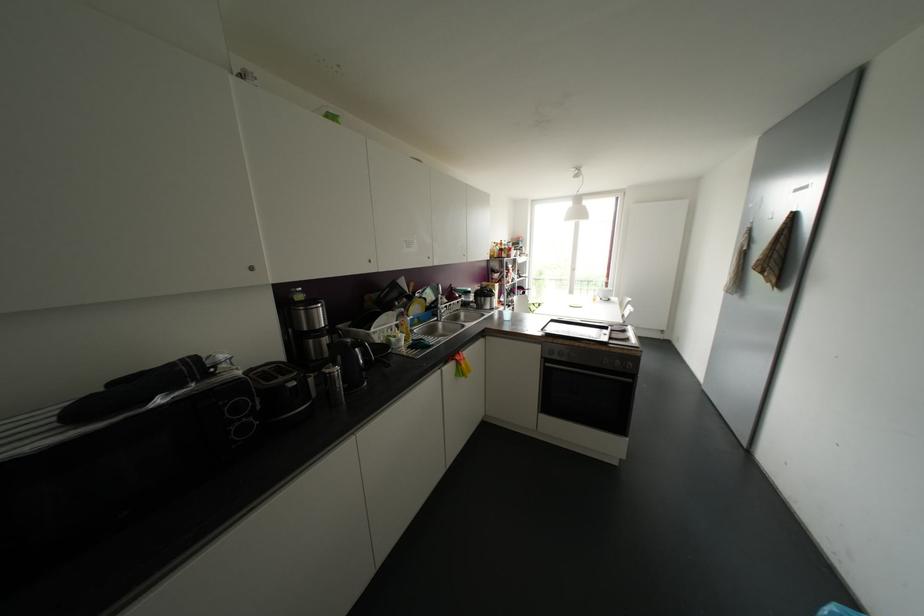
This screenshot has width=924, height=616. Find the location of `oven door handle`. oven door handle is located at coordinates [590, 371].